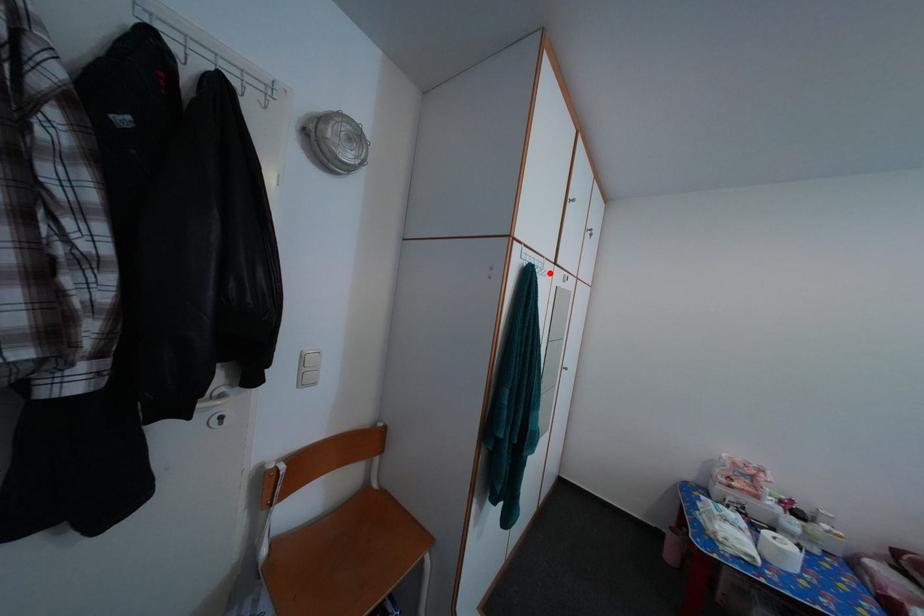
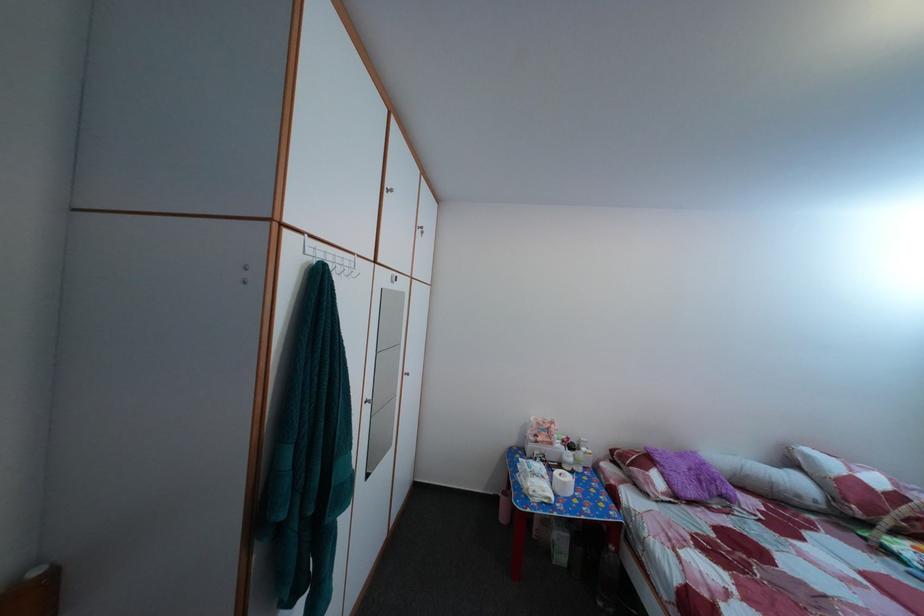
Locate, in the second image, the point that corresponds to the highlighted location in the first image.

(356, 270)